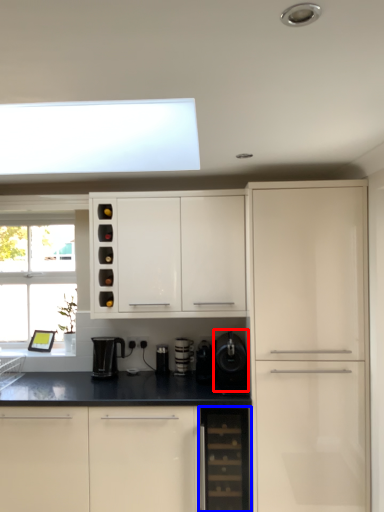
Question: Which object appears farthest to the camera in this image, appliance (highlighted by a red box) or dish washer (highlighted by a blue box)?

Choices:
 (A) appliance
 (B) dish washer

Answer: (A)